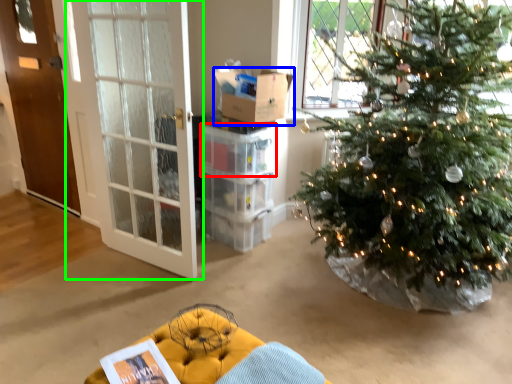
Question: Which is farther away from crate (highlighted by a red box)? box (highlighted by a blue box) or door (highlighted by a green box)?

Choices:
 (A) box
 (B) door

Answer: (B)